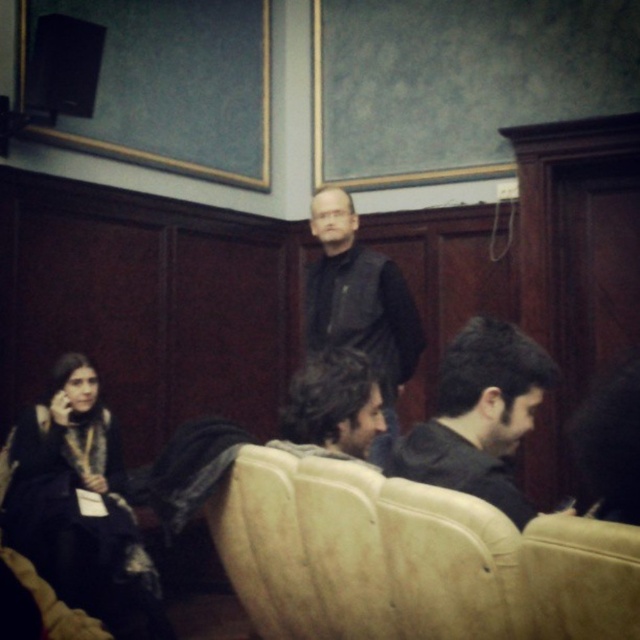
Question: Based on their relative distances, which object is farther from the dark gray hoodie at center?

Choices:
 (A) dark matte dress at lower left
 (B) dark brown hair at center
 (C) black leather vest at center
 (D) light brown leather armchair at lower center

Answer: (A)

Question: Which point is farther to the camera?

Choices:
 (A) (355, 380)
 (B) (392, 468)
 (C) (547, 628)
 (D) (36, 406)

Answer: (D)

Question: Is dark matte dress at lower left smaller than black leather vest at center?

Choices:
 (A) yes
 (B) no

Answer: (B)

Question: Can you confirm if dark gray hoodie at center is thinner than light brown leather armchair at lower center?

Choices:
 (A) no
 (B) yes

Answer: (A)

Question: Does black leather vest at center have a lesser width compared to light brown leather armchair at lower center?

Choices:
 (A) no
 (B) yes

Answer: (A)

Question: Which point is farther to the camera?

Choices:
 (A) dark gray hoodie at center
 (B) dark matte dress at lower left
 (C) light brown leather armchair at lower center

Answer: (B)